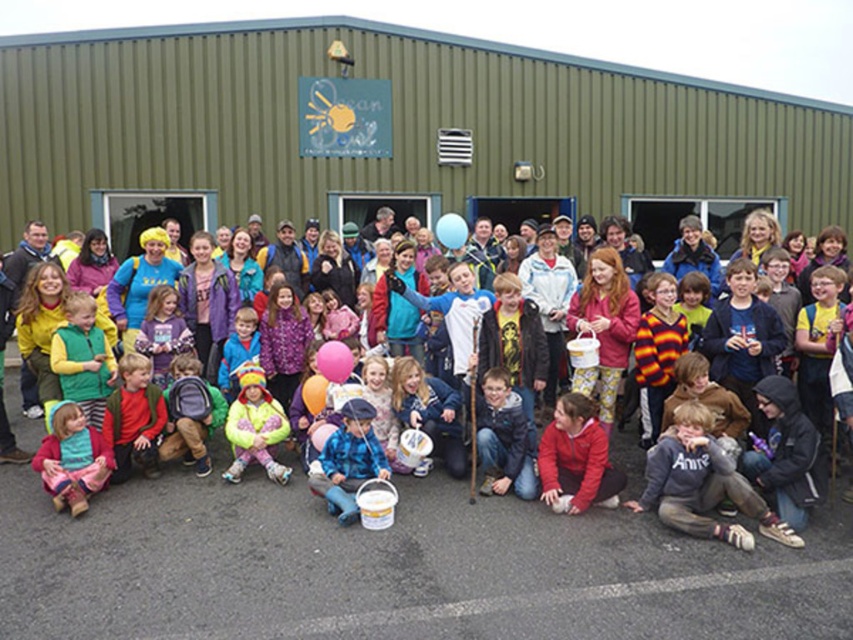
From the picture: You are a photographer positioned at the back of the group. You want to take a photo that includes both the matte pink sweater at lower left and the fluorescent yellow jacket at center. Which object should you adjust your camera angle to focus on first to ensure both are in frame?

The matte pink sweater at lower left is below the fluorescent yellow jacket at center, so you should lower your camera angle to include the sweater first, then ensure the jacket is visible above it.

You are organizing an outdoor event and need to place items in order of size from widest to narrowest. Given the matte blue bucket at center and the rubber pink balloon at center, which should come first?

The matte blue bucket at center might be wider than the rubber pink balloon at center, so it should be placed first in the order from widest to narrowest.